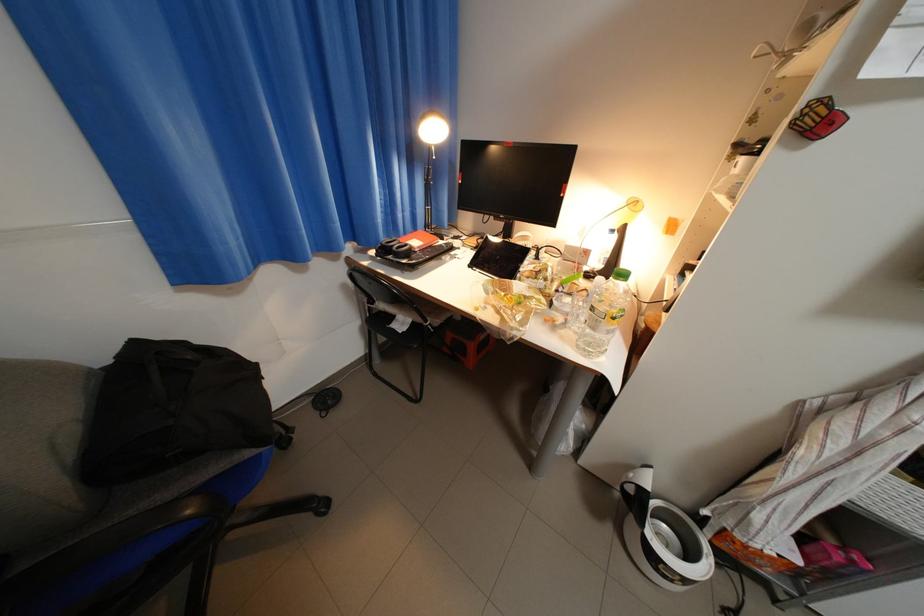
The location [662,536] corresponds to which object?

It refers to a white ceramic mug.